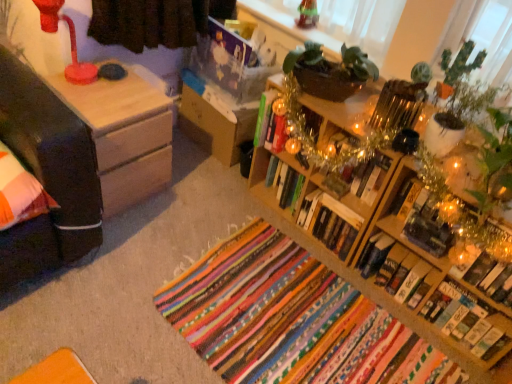
At what (x,y) coordinates should I click in order to perform the action: click on free location in front of matte plastic lamp at upper left. Please return your answer as a coordinate pair (x, y). This screenshot has width=512, height=384. Looking at the image, I should click on (77, 99).